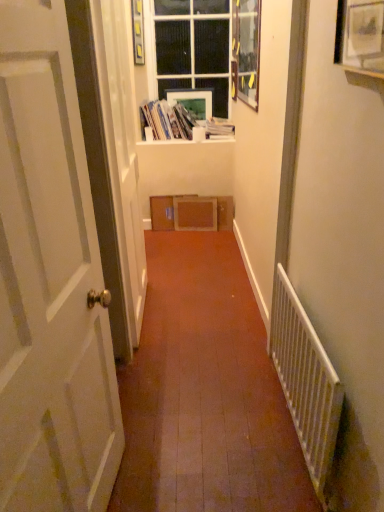
Question: Does white cardboard box at upper center, which appears as the 2th book when viewed from the right, have a greater width compared to matte white picture frame at upper center, which is counted as the second picture frame, starting from the back?

Choices:
 (A) no
 (B) yes

Answer: (B)

Question: Does white cardboard box at upper center, the 1th book positioned from the left, lie behind matte white picture frame at upper center, the first picture frame from the left?

Choices:
 (A) yes
 (B) no

Answer: (A)

Question: Considering the relative sizes of white cardboard box at upper center, the 1th book positioned from the left, and matte white picture frame at upper center, the first picture frame from the left, in the image provided, is white cardboard box at upper center, the 1th book positioned from the left, smaller than matte white picture frame at upper center, the first picture frame from the left,?

Choices:
 (A) no
 (B) yes

Answer: (A)

Question: From the image's perspective, is white cardboard box at upper center, which appears as the 2th book when viewed from the right, located beneath matte white picture frame at upper center, which is counted as the third picture frame, starting from the front?

Choices:
 (A) no
 (B) yes

Answer: (B)

Question: Is matte white picture frame at upper center, which is counted as the second picture frame, starting from the back, completely or partially inside white cardboard box at upper center, the 1th book positioned from the left?

Choices:
 (A) yes
 (B) no

Answer: (B)

Question: In terms of size, does wooden picture frame at upper center, which is counted as the third picture frame, starting from the left, appear bigger or smaller than matte white picture frame at upper center, the fourth picture frame when ordered from front to back?

Choices:
 (A) small
 (B) big

Answer: (B)

Question: Is wooden picture frame at upper center, which is the second picture frame from front to back, situated inside matte white picture frame at upper center, the fourth picture frame when ordered from front to back, or outside?

Choices:
 (A) inside
 (B) outside

Answer: (B)

Question: From a real-world perspective, relative to matte white picture frame at upper center, the third picture frame in the right-to-left sequence, is wooden picture frame at upper center, which ranks as the 3th picture frame in back-to-front order, vertically above or below?

Choices:
 (A) below
 (B) above

Answer: (B)

Question: Is wooden picture frame at upper center, which is the second picture frame from front to back, taller or shorter than matte white picture frame at upper center, the fourth picture frame when ordered from front to back?

Choices:
 (A) short
 (B) tall

Answer: (B)

Question: Is white paper book at upper center, placed as the second book when sorted from left to right, wider or thinner than white matte window sill at upper center?

Choices:
 (A) thin
 (B) wide

Answer: (B)

Question: From the image's perspective, is white paper book at upper center, placed as the second book when sorted from left to right, positioned above or below white matte window sill at upper center?

Choices:
 (A) above
 (B) below

Answer: (A)

Question: Considering the positions of point (218, 122) and point (225, 135), is point (218, 122) closer or farther from the camera than point (225, 135)?

Choices:
 (A) farther
 (B) closer

Answer: (A)

Question: Considering the positions of white paper book at upper center, placed as the second book when sorted from left to right, and white matte window sill at upper center in the image, is white paper book at upper center, placed as the second book when sorted from left to right, taller or shorter than white matte window sill at upper center?

Choices:
 (A) tall
 (B) short

Answer: (A)

Question: From the image's perspective, is white cardboard box at upper center, the 1th book positioned from the left, located above or below clear glass window at upper center?

Choices:
 (A) above
 (B) below

Answer: (B)

Question: Is white cardboard box at upper center, which appears as the 2th book when viewed from the right, inside the boundaries of clear glass window at upper center, or outside?

Choices:
 (A) inside
 (B) outside

Answer: (B)